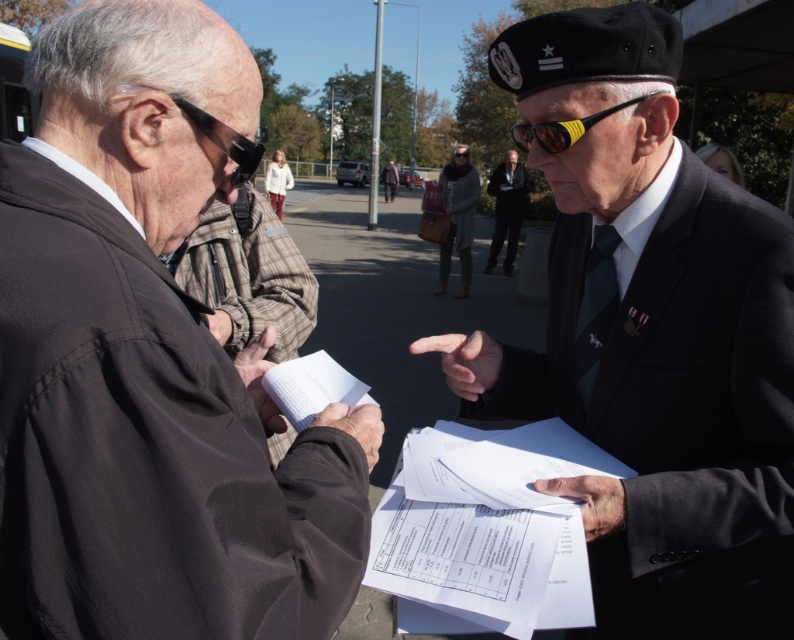
You are a photographer standing in front of the two men. You notice the brown plaid robe at center and the white paper at center. Which object is closer to you?

The brown plaid robe at center is closer to you because the white paper at center is behind it.

You are an office worker who needs to file a document. You see the white paper at center and the gray woolen robe at center. Which object is shorter in height?

The white paper at center has a lesser height compared to the gray woolen robe at center, so the white paper at center is shorter in height.

You are a tailor observing two men in the scene. You need to determine which clothing item, the gray woolen robe at center or the dark gray suit at center, requires more vertical space for storage. Based on their sizes, which one should be placed higher on the rack?

The dark gray suit at center is taller than the gray woolen robe at center, so it requires more vertical space and should be placed higher on the rack.